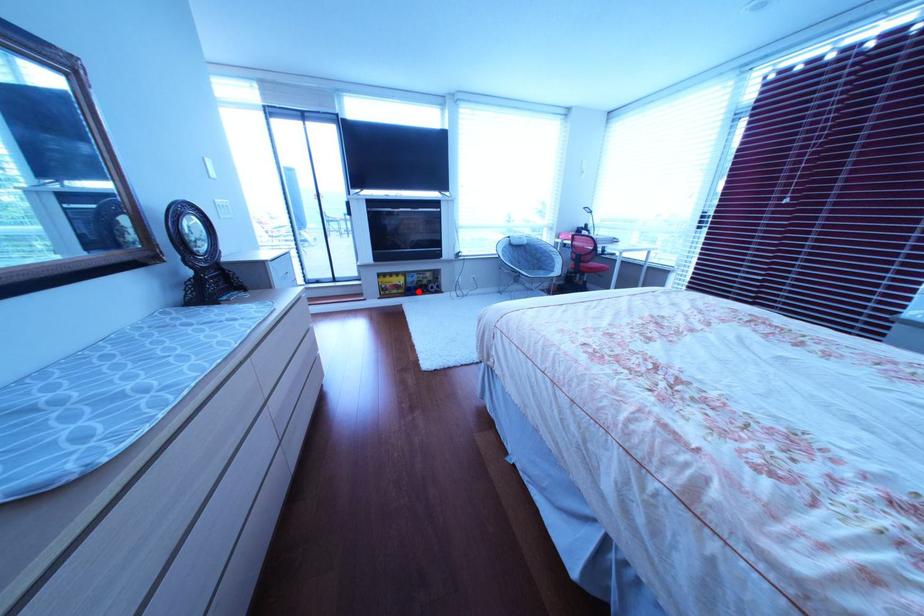
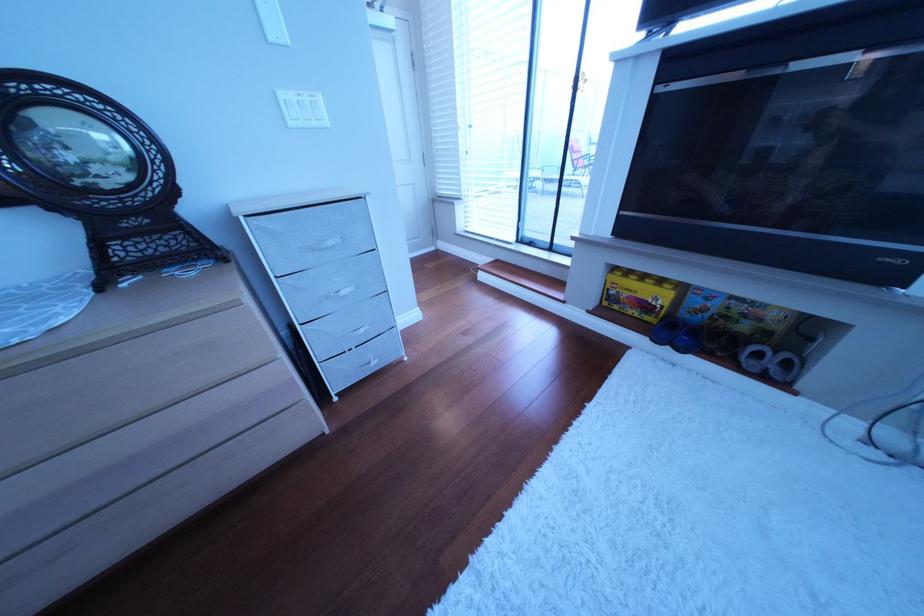
Question: I am providing you with two images of the same scene from different viewpoints. Given a red point in image1, look at the same physical point in image2. Is it:

Choices:
 (A) Closer to the viewpoint
 (B) Farther from the viewpoint

Answer: (A)